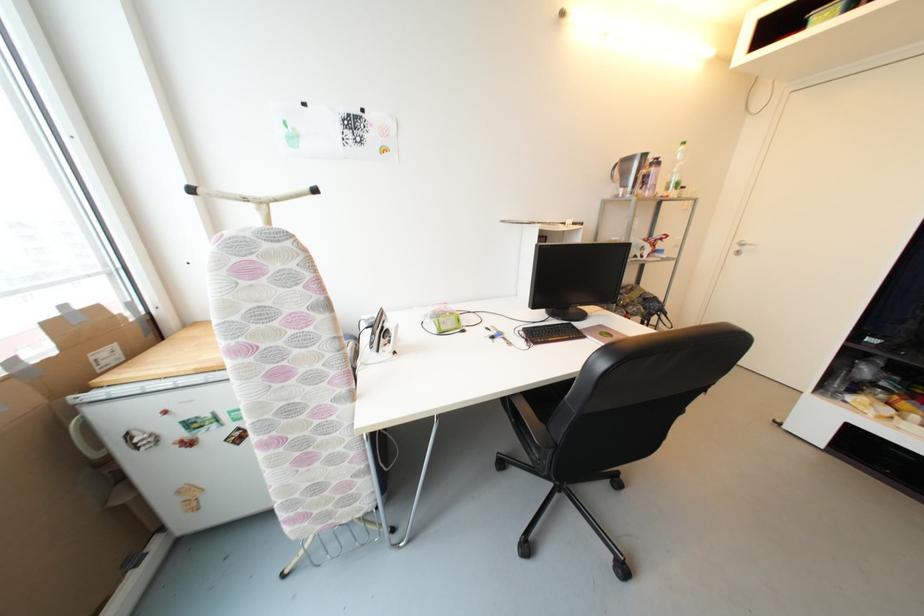
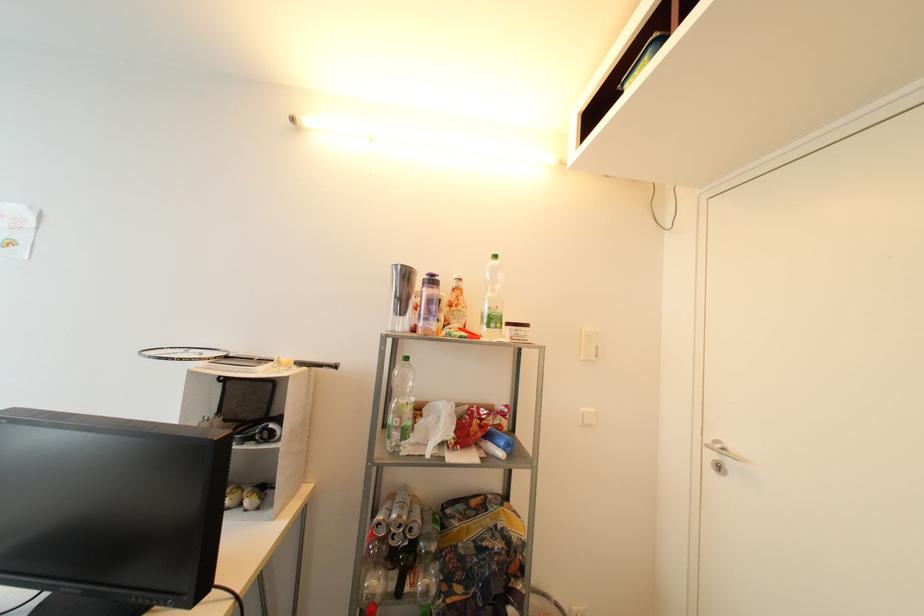
In the second image, find the point that corresponds to the point at 661,164 in the first image.

(438, 283)